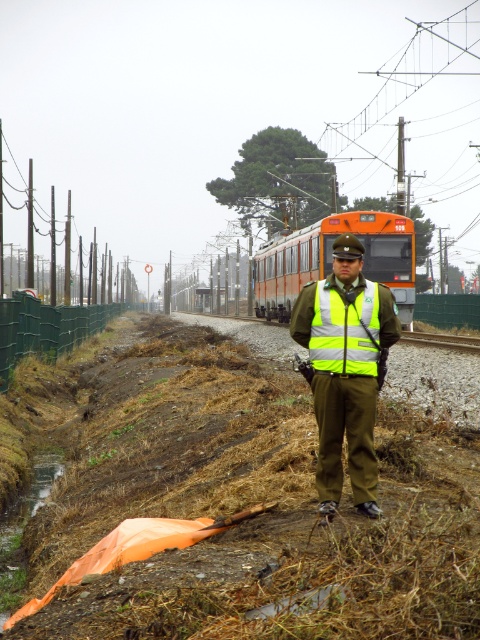
Question: Does yellow reflective safety vest at center have a lesser width compared to gravel train track at center?

Choices:
 (A) no
 (B) yes

Answer: (B)

Question: Which object is the closest to the reflective yellow vest at center?

Choices:
 (A) yellow reflective safety vest at center
 (B) green plastic fence at left
 (C) orange matte train at center
 (D) gravel train track at center

Answer: (A)

Question: Which point is closer to the camera taking this photo?

Choices:
 (A) (36, 337)
 (B) (402, 339)
 (C) (372, 266)

Answer: (A)

Question: Can you confirm if orange matte train at center is positioned below green plastic fence at left?

Choices:
 (A) yes
 (B) no

Answer: (B)

Question: Where is yellow reflective safety vest at center located in relation to gravel train track at center in the image?

Choices:
 (A) above
 (B) below

Answer: (A)

Question: Which object is closer to the camera taking this photo?

Choices:
 (A) reflective yellow vest at center
 (B) orange matte train at center

Answer: (A)